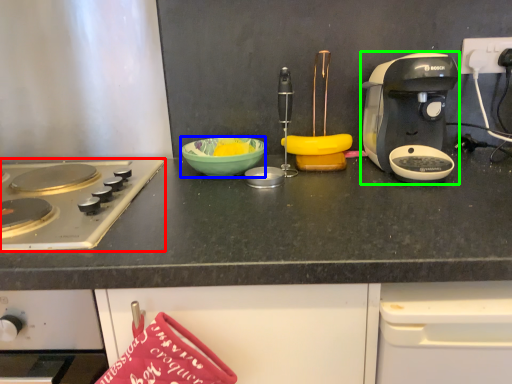
Question: Which object is the closest to the gas stove (highlighted by a red box)? Choose among these: bowl (highlighted by a blue box) or coffee maker (highlighted by a green box).

Choices:
 (A) bowl
 (B) coffee maker

Answer: (A)